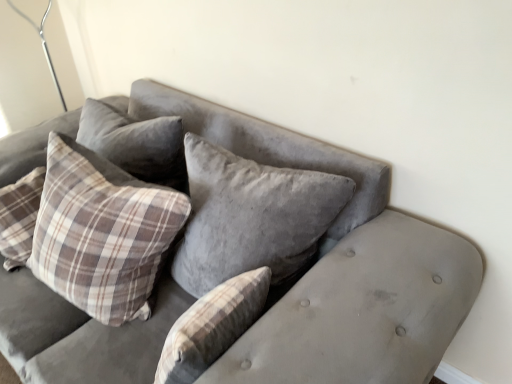
What do you see at coordinates (102, 233) in the screenshot? I see `plaid fabric pillow at left` at bounding box center [102, 233].

Where is `plaid fabric pillow at left`? The image size is (512, 384). plaid fabric pillow at left is located at coordinates (102, 233).

At what (x,y) coordinates should I click in order to perform the action: click on plaid fabric pillow at left. Please return your answer as a coordinate pair (x, y). The image size is (512, 384). Looking at the image, I should click on (102, 233).